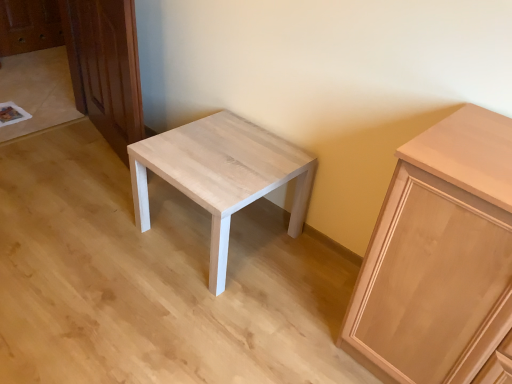
Locate an element on the screen. The width and height of the screenshot is (512, 384). vacant area to the right of light wood/texture stool at center is located at coordinates (310, 272).